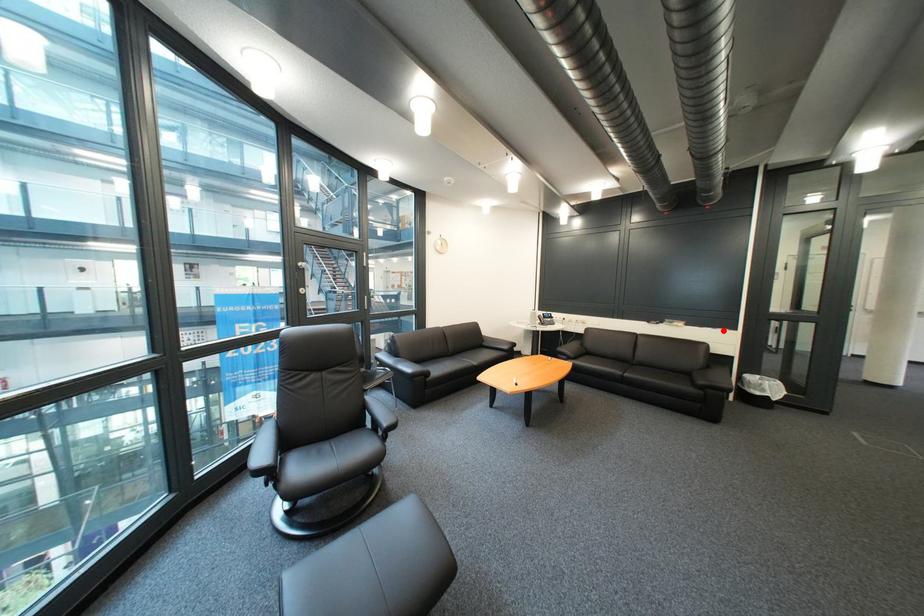
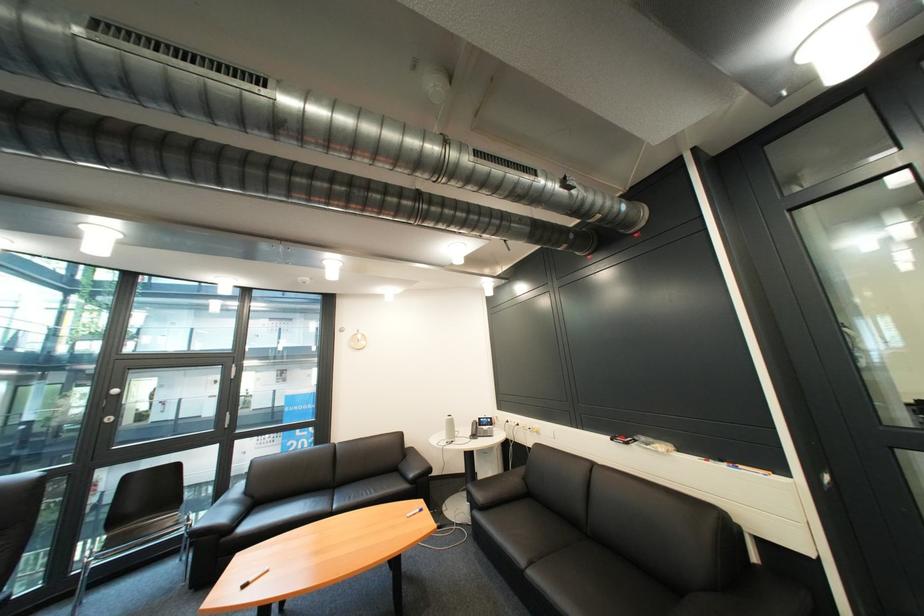
The point at the highlighted location is marked in the first image. Where is the corresponding point in the second image?

(736, 468)